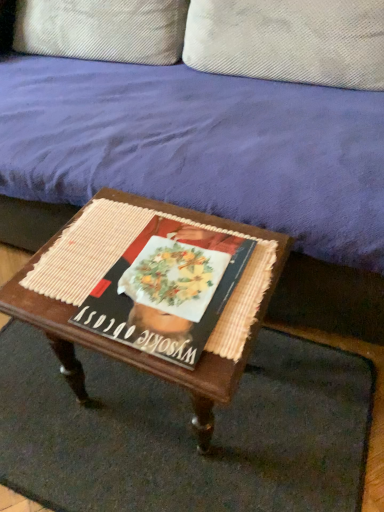
Identify the location of vacant point to the left of matte paper magazine at center. (67, 273).